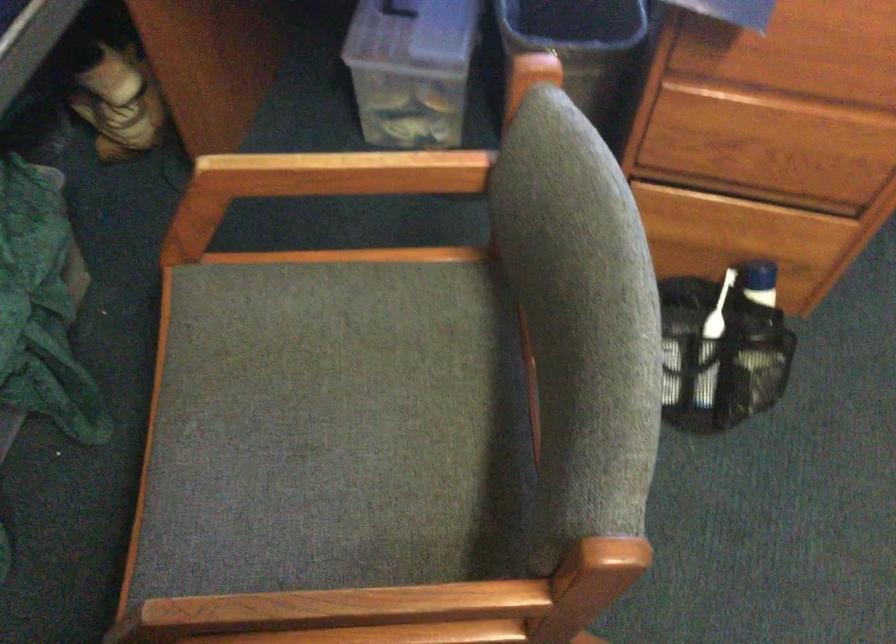
Where is `wooden drawer pull`? The width and height of the screenshot is (896, 644). wooden drawer pull is located at coordinates (751, 147).